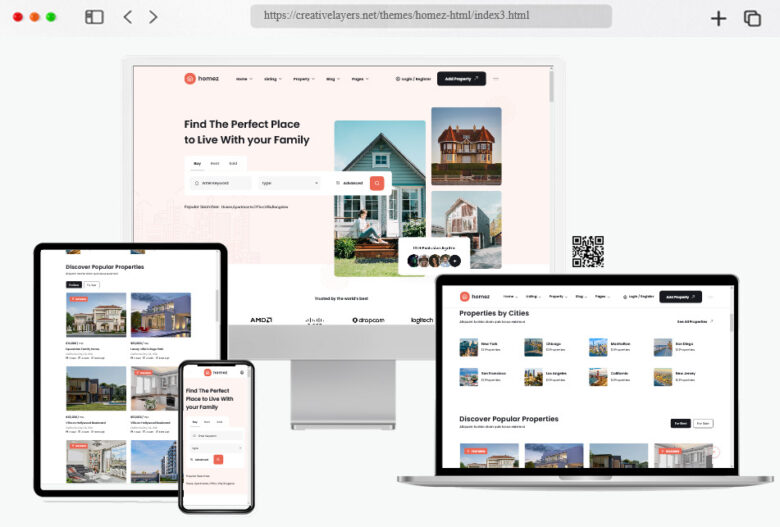
The height and width of the screenshot is (527, 780). I want to click on ipad, so click(36, 283).